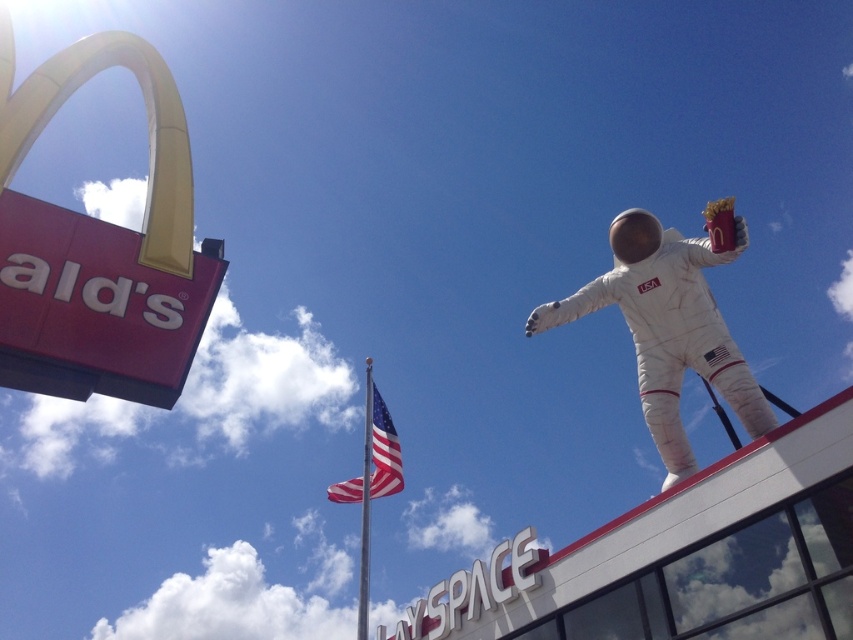
Question: Which object is farther from the camera taking this photo?

Choices:
 (A) american flag at center
 (B) white fabric astronaut at upper right

Answer: (A)

Question: Which point is closer to the camera taking this photo?

Choices:
 (A) (334, 493)
 (B) (680, 468)

Answer: (B)

Question: Can you confirm if white fabric astronaut at upper right is positioned above american flag at center?

Choices:
 (A) no
 (B) yes

Answer: (B)

Question: Does white fabric astronaut at upper right have a greater width compared to american flag at center?

Choices:
 (A) yes
 (B) no

Answer: (A)

Question: Can you confirm if white fabric astronaut at upper right is wider than american flag at center?

Choices:
 (A) yes
 (B) no

Answer: (A)